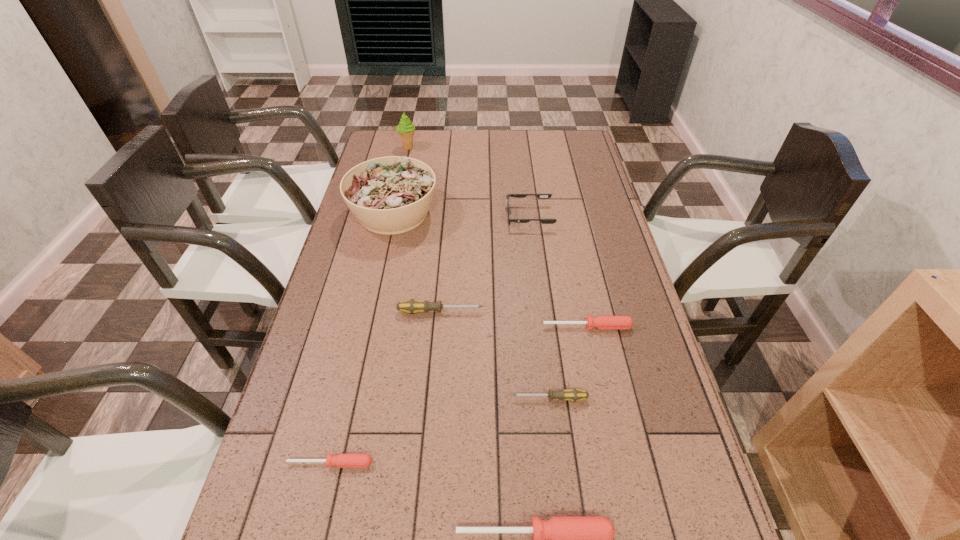
Find the location of a particular element. empty space that is in between the farthest screwdriver and the second nearest object is located at coordinates (385, 387).

Find the location of a particular element. The image size is (960, 540). vacant space that's between the fifth farthest object and the sunglasses is located at coordinates [559, 272].

Identify which object is located as the fifth nearest to the sunglasses. Please provide its 2D coordinates. Your answer should be formatted as a tuple, i.e. [(x, y)], where the tuple contains the x and y coordinates of a point satisfying the conditions above.

[(574, 394)]

The width and height of the screenshot is (960, 540). What are the coordinates of `the sixth closest object relative to the smaller gray screwdriver` in the screenshot? It's located at (541, 196).

You are a GUI agent. You are given a task and a screenshot of the screen. Output one action in this format:
    pyautogui.click(x=<x>, y=<y>)
    Task: Click on the screwdriver that is the second nearest to the salad
    The height and width of the screenshot is (540, 960).
    Given the screenshot: What is the action you would take?
    pyautogui.click(x=601, y=322)

Where is `screwdriver that is the closest one to the third nearest screwdriver`? The height and width of the screenshot is (540, 960). screwdriver that is the closest one to the third nearest screwdriver is located at coordinates (601, 322).

At what (x,y) coordinates should I click in order to perform the action: click on the third closest red screwdriver to the fifth nearest object. Please return your answer as a coordinate pair (x, y). Looking at the image, I should click on (563, 539).

Locate an element on the screen. Image resolution: width=960 pixels, height=540 pixels. red screwdriver that is the closest to the second farthest screwdriver is located at coordinates (563, 539).

Locate an element on the screen. This screenshot has height=540, width=960. vacant area in the image that satisfies the following two spatial constraints: 1. on the front side of the second smallest red screwdriver; 2. at the tip of the right gray screwdriver is located at coordinates (603, 399).

Where is `vacant space that satisfies the following two spatial constraints: 1. on the temples of the sunglasses; 2. on the right side of the second smallest red screwdriver`? vacant space that satisfies the following two spatial constraints: 1. on the temples of the sunglasses; 2. on the right side of the second smallest red screwdriver is located at coordinates (543, 326).